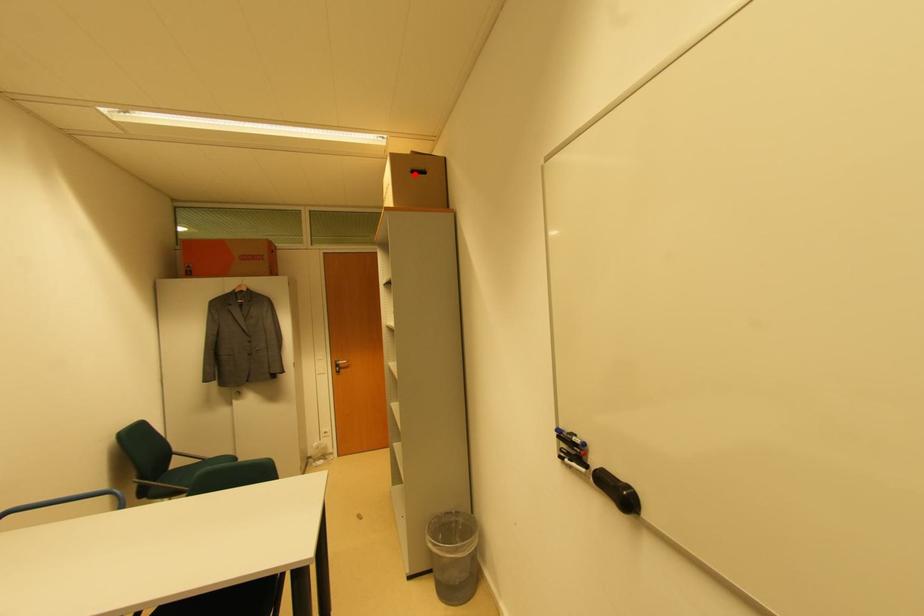
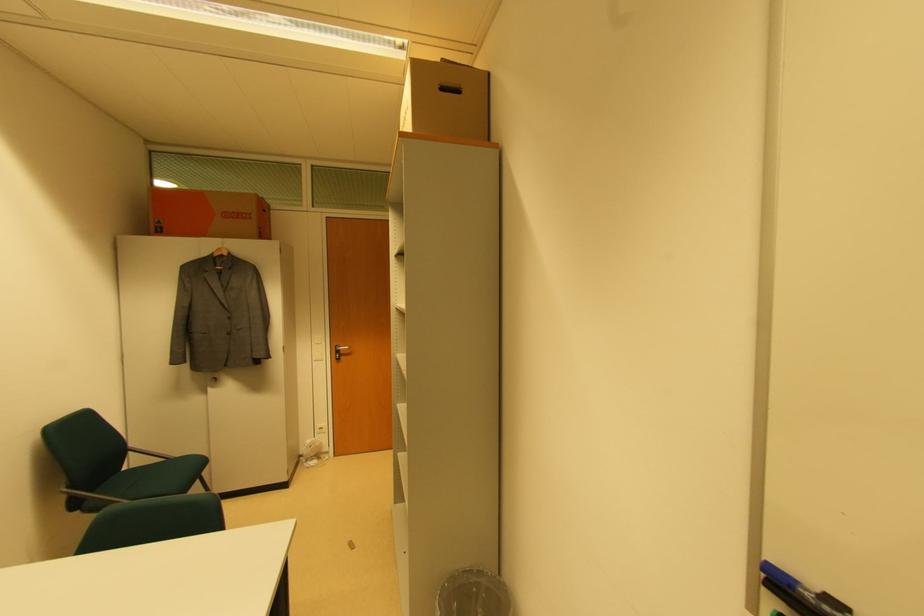
In the second image, find the point that corresponds to the highlighted location in the first image.

(444, 91)